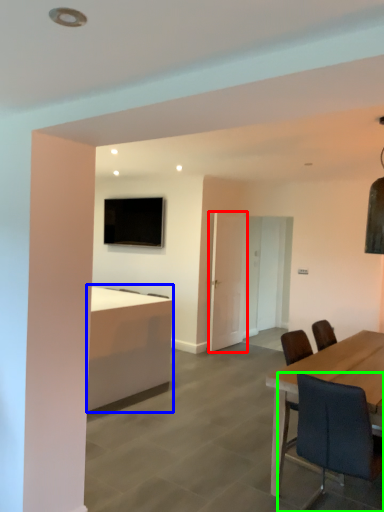
Question: Which object is positioned farthest from glass door (highlighted by a red box)? Select from desk (highlighted by a blue box) and chair (highlighted by a green box).

Choices:
 (A) desk
 (B) chair

Answer: (B)